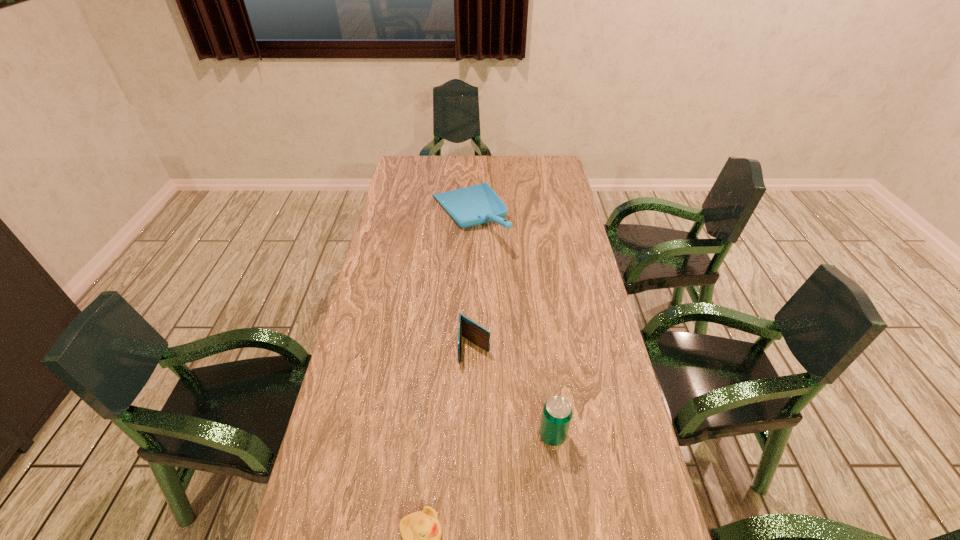
Locate an element on the screen. The width and height of the screenshot is (960, 540). vacant space at the left edge is located at coordinates (383, 219).

Image resolution: width=960 pixels, height=540 pixels. What are the coordinates of `vacant space at the right edge` in the screenshot? It's located at (552, 239).

In the image, there is a desktop. Identify the location of vacant space at the far right corner. (544, 173).

Where is `vacant space in between the wallet and the rightmost object`? The height and width of the screenshot is (540, 960). vacant space in between the wallet and the rightmost object is located at coordinates (514, 392).

What are the coordinates of `free area in between the farthest object and the rightmost object` in the screenshot? It's located at (511, 326).

Identify the location of vacant space in between the farthest object and the second shortest object. The width and height of the screenshot is (960, 540). (471, 282).

You are a GUI agent. You are given a task and a screenshot of the screen. Output one action in this format:
    pyautogui.click(x=<x>, y=<y>)
    Task: Click on the vacant point located between the second shortest object and the dustpan
    This screenshot has width=960, height=540.
    Given the screenshot: What is the action you would take?
    pyautogui.click(x=471, y=282)

You are a GUI agent. You are given a task and a screenshot of the screen. Output one action in this format:
    pyautogui.click(x=<x>, y=<y>)
    Task: Click on the free area in between the second nearest object and the farthest object
    The height and width of the screenshot is (540, 960).
    Given the screenshot: What is the action you would take?
    pyautogui.click(x=511, y=326)

Select which object is the third closest to the farthest object. Please provide its 2D coordinates. Your answer should be formatted as a tuple, i.e. [(x, y)], where the tuple contains the x and y coordinates of a point satisfying the conditions above.

[(421, 531)]

Image resolution: width=960 pixels, height=540 pixels. In order to click on object that is the closest to the farthest object in this screenshot , I will do `click(478, 335)`.